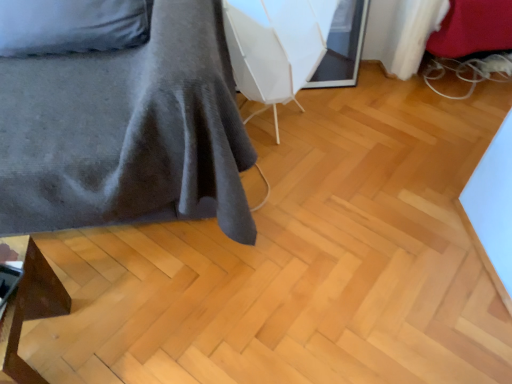
Locate an element on the screen. free space to the back side of matte brown wooden stool at lower left, which ranks as the 2th furniture in top-to-bottom order is located at coordinates (92, 278).